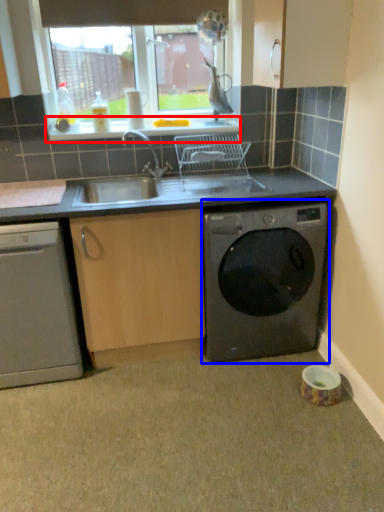
Question: Which object is closer to the camera taking this photo, window sill (highlighted by a red box) or washing machine (highlighted by a blue box)?

Choices:
 (A) window sill
 (B) washing machine

Answer: (B)